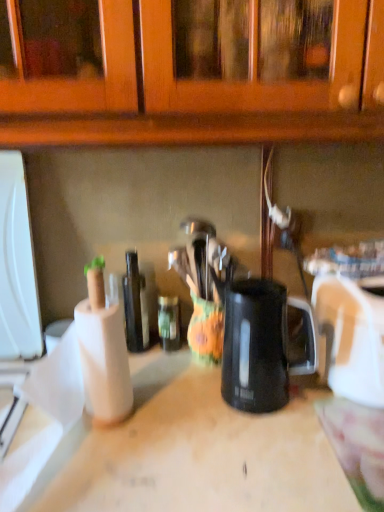
Where is `vacant space situated above white plastic toaster at right (from a real-world perspective)`? Image resolution: width=384 pixels, height=512 pixels. vacant space situated above white plastic toaster at right (from a real-world perspective) is located at coordinates (354, 279).